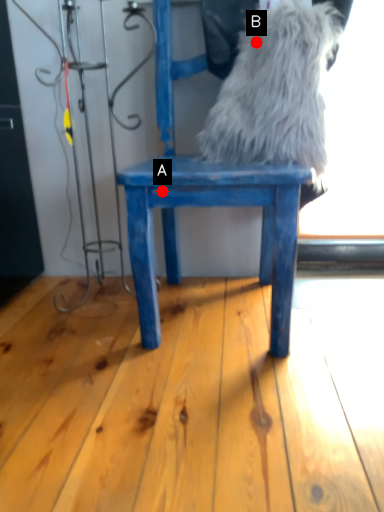
Question: Two points are circled on the image, labeled by A and B beside each circle. Which point is closer to the camera taking this photo?

Choices:
 (A) A is closer
 (B) B is closer

Answer: (A)